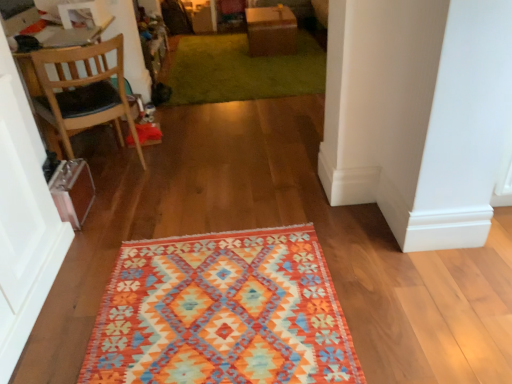
Question: Is textured woolen rug at center oriented towards brown cardboard box at upper center?

Choices:
 (A) yes
 (B) no

Answer: (B)

Question: From a real-world perspective, is textured woolen rug at center physically above brown cardboard box at upper center?

Choices:
 (A) no
 (B) yes

Answer: (A)

Question: Considering the relative sizes of textured woolen rug at center and brown cardboard box at upper center in the image provided, is textured woolen rug at center bigger than brown cardboard box at upper center?

Choices:
 (A) yes
 (B) no

Answer: (B)

Question: From a real-world perspective, is textured woolen rug at center positioned under brown cardboard box at upper center based on gravity?

Choices:
 (A) no
 (B) yes

Answer: (B)

Question: Is textured woolen rug at center placed right next to brown cardboard box at upper center?

Choices:
 (A) yes
 (B) no

Answer: (B)

Question: Is textured woolen rug at center closer to camera compared to brown cardboard box at upper center?

Choices:
 (A) no
 (B) yes

Answer: (B)

Question: Is the depth of green shaggy rug at upper center greater than that of textured woolen rug at center?

Choices:
 (A) yes
 (B) no

Answer: (A)

Question: Is green shaggy rug at upper center touching textured woolen rug at center?

Choices:
 (A) no
 (B) yes

Answer: (A)

Question: From a real-world perspective, does green shaggy rug at upper center sit lower than textured woolen rug at center?

Choices:
 (A) no
 (B) yes

Answer: (A)

Question: Can you confirm if green shaggy rug at upper center is bigger than textured woolen rug at center?

Choices:
 (A) no
 (B) yes

Answer: (B)

Question: Is green shaggy rug at upper center positioned before textured woolen rug at center?

Choices:
 (A) yes
 (B) no

Answer: (B)

Question: Are green shaggy rug at upper center and textured woolen rug at center located far from each other?

Choices:
 (A) yes
 (B) no

Answer: (A)

Question: Are brown cardboard box at upper center and wooden chair at left far apart?

Choices:
 (A) no
 (B) yes

Answer: (B)